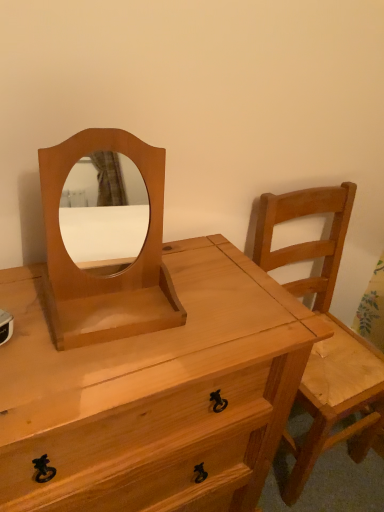
Question: From a real-world perspective, is light brown wood mirror at center physically located above or below natural wood chest of drawers at center?

Choices:
 (A) above
 (B) below

Answer: (A)

Question: Is light brown wood mirror at center spatially inside natural wood chest of drawers at center, or outside of it?

Choices:
 (A) inside
 (B) outside

Answer: (B)

Question: Based on their relative distances, which object is farther from the light brown wooden chair at right?

Choices:
 (A) natural wood chest of drawers at center
 (B) light brown wood mirror at center

Answer: (B)

Question: Which object is positioned closest to the light brown wooden chair at right?

Choices:
 (A) light brown wood mirror at center
 (B) natural wood chest of drawers at center

Answer: (B)